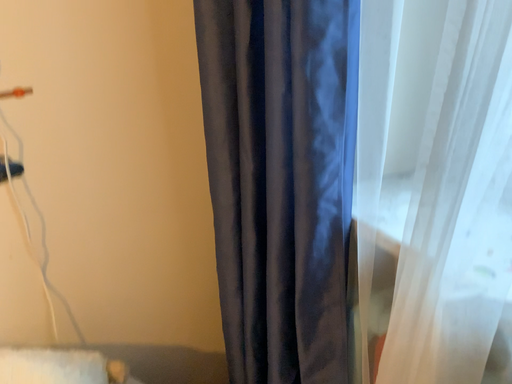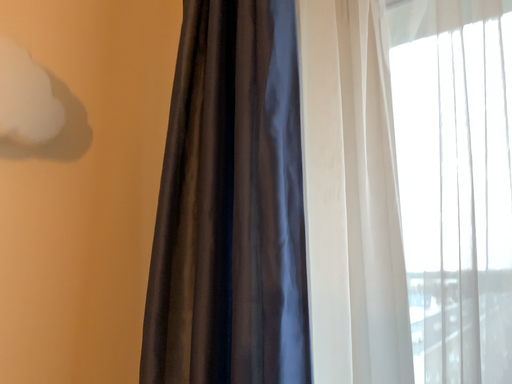
Question: Which way did the camera rotate in the video?

Choices:
 (A) rotated upward
 (B) rotated downward

Answer: (A)